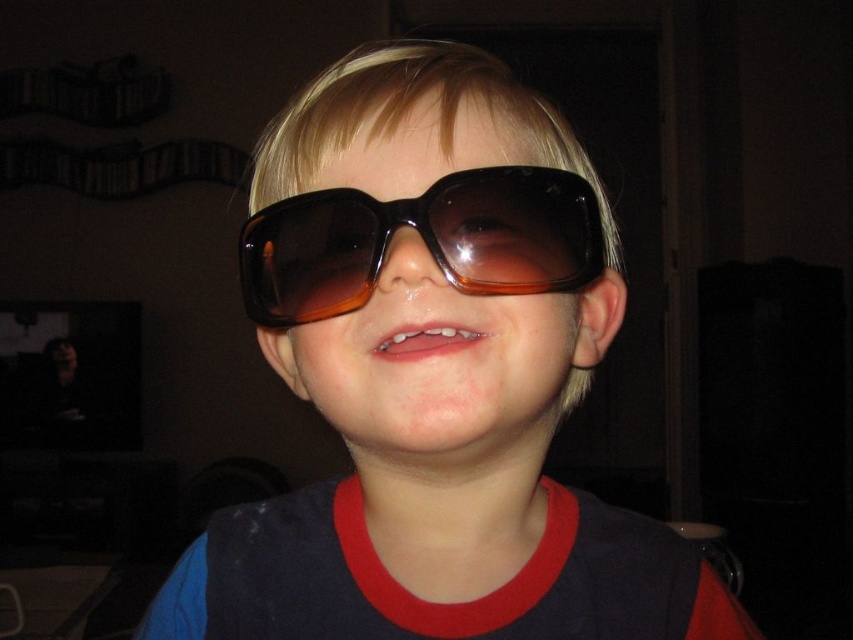
Question: Which of the following is the closest to the observer?

Choices:
 (A) brown translucent plastic goggles at center
 (B) brown matte sunglasses at center

Answer: (B)

Question: Which point appears farthest from the camera in this image?

Choices:
 (A) (532, 614)
 (B) (525, 205)

Answer: (A)

Question: Does brown matte sunglasses at center have a smaller size compared to brown translucent plastic goggles at center?

Choices:
 (A) no
 (B) yes

Answer: (A)

Question: Can you confirm if brown matte sunglasses at center is positioned below brown translucent plastic goggles at center?

Choices:
 (A) no
 (B) yes

Answer: (B)

Question: Which point appears closest to the camera in this image?

Choices:
 (A) (556, 224)
 (B) (408, 611)

Answer: (A)

Question: Is brown matte sunglasses at center wider than brown translucent plastic goggles at center?

Choices:
 (A) yes
 (B) no

Answer: (A)